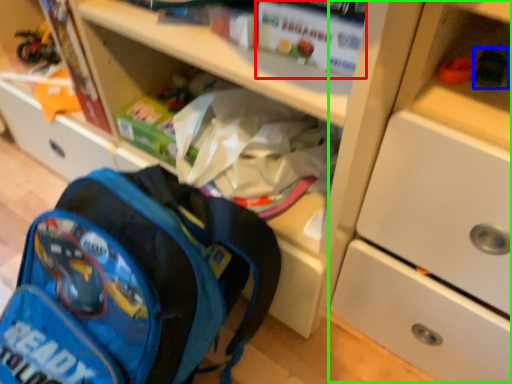
Question: Considering the real-world distances, which object is farthest from paperback book (highlighted by a red box)? toy (highlighted by a blue box) or cabinetry (highlighted by a green box)?

Choices:
 (A) toy
 (B) cabinetry

Answer: (B)